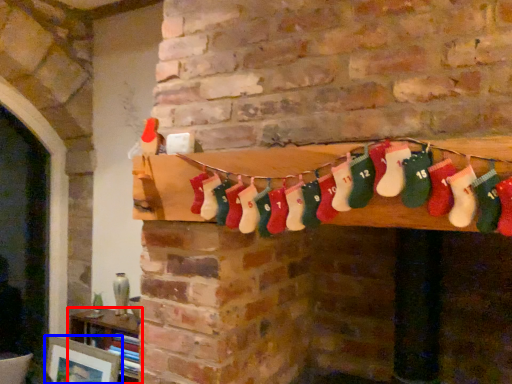
Question: Which object appears farthest to the camera in this image, furniture (highlighted by a red box) or picture frame (highlighted by a blue box)?

Choices:
 (A) furniture
 (B) picture frame

Answer: (A)